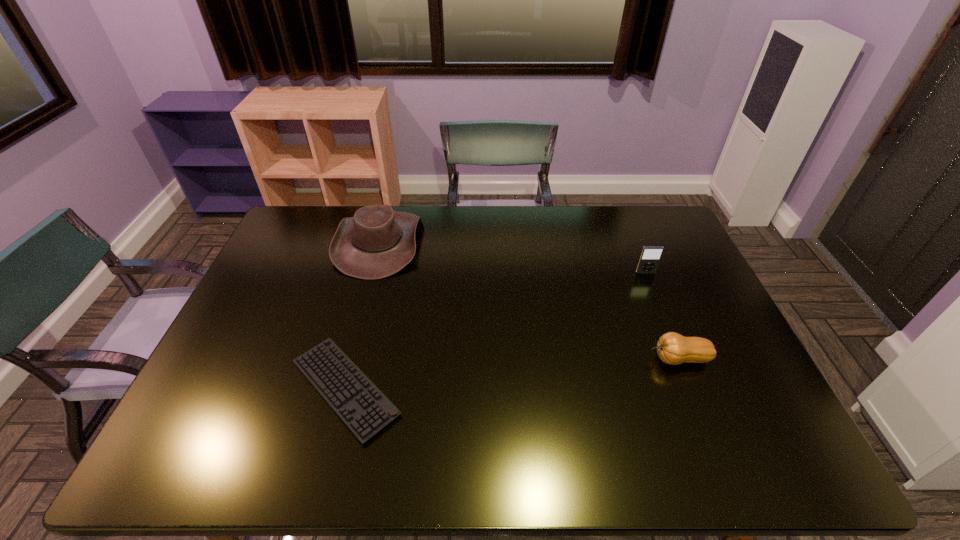
In the image, there is a desktop. At what (x,y) coordinates should I click in order to perform the action: click on vacant space at the near right corner. Please return your answer as a coordinate pair (x, y). This screenshot has height=540, width=960. Looking at the image, I should click on (795, 463).

Where is `vacant space in between the shortest object and the iPod`? vacant space in between the shortest object and the iPod is located at coordinates (495, 330).

Where is `empty location between the iPod and the gourd`? empty location between the iPod and the gourd is located at coordinates (661, 316).

This screenshot has width=960, height=540. Identify the location of unoccupied position between the shortest object and the cowboy hat. (362, 315).

The height and width of the screenshot is (540, 960). I want to click on unoccupied area between the shortest object and the gourd, so click(x=512, y=374).

Image resolution: width=960 pixels, height=540 pixels. I want to click on free point between the cowboy hat and the iPod, so click(512, 258).

Where is `empty space that is in between the shortest object and the cowboy hat`? The height and width of the screenshot is (540, 960). empty space that is in between the shortest object and the cowboy hat is located at coordinates (362, 315).

I want to click on vacant space in between the computer keyboard and the cowboy hat, so click(362, 315).

Locate an element on the screen. The width and height of the screenshot is (960, 540). free spot between the cowboy hat and the gourd is located at coordinates (529, 300).

Find the location of a particular element. The width and height of the screenshot is (960, 540). free space between the gourd and the cowboy hat is located at coordinates (529, 300).